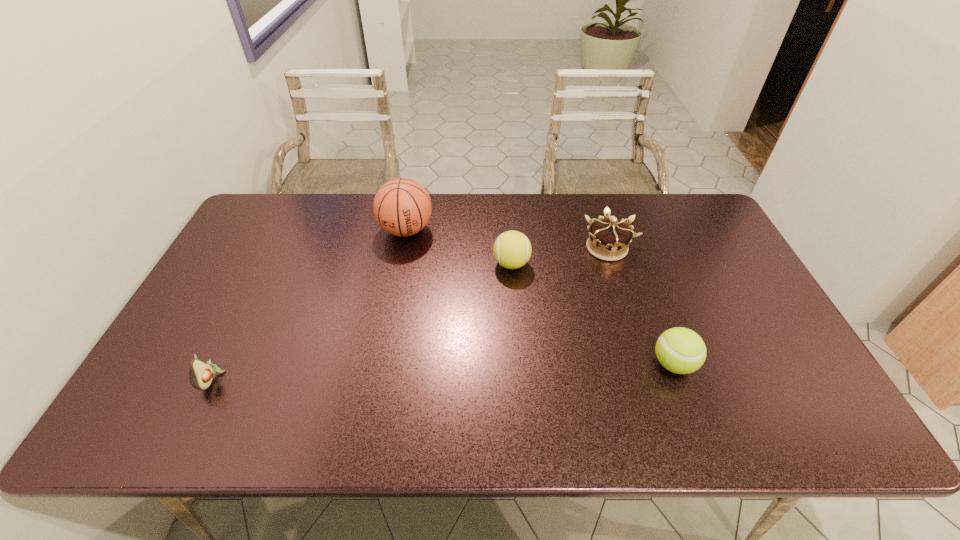
Where is `the fourth object from right to left`? the fourth object from right to left is located at coordinates (402, 207).

At what (x,y) coordinates should I click in order to perform the action: click on the tallest object. Please return your answer as a coordinate pair (x, y). The image size is (960, 540). Looking at the image, I should click on (402, 207).

Where is `crown`? The image size is (960, 540). crown is located at coordinates (612, 237).

In order to click on the farther tennis ball in this screenshot , I will do `click(512, 249)`.

This screenshot has height=540, width=960. Find the location of `the left tennis ball`. the left tennis ball is located at coordinates [512, 249].

Locate an element on the screen. The height and width of the screenshot is (540, 960). the nearer tennis ball is located at coordinates (680, 350).

Identify the location of the leftmost object. Image resolution: width=960 pixels, height=540 pixels. (201, 374).

Find the location of `vacant space situated on the surface of the basketball near the brand logo`. vacant space situated on the surface of the basketball near the brand logo is located at coordinates (389, 323).

Locate an element on the screen. The height and width of the screenshot is (540, 960). free spot located on the right of the crown is located at coordinates (689, 248).

Locate an element on the screen. This screenshot has width=960, height=540. vacant region located on the back of the left tennis ball is located at coordinates (510, 239).